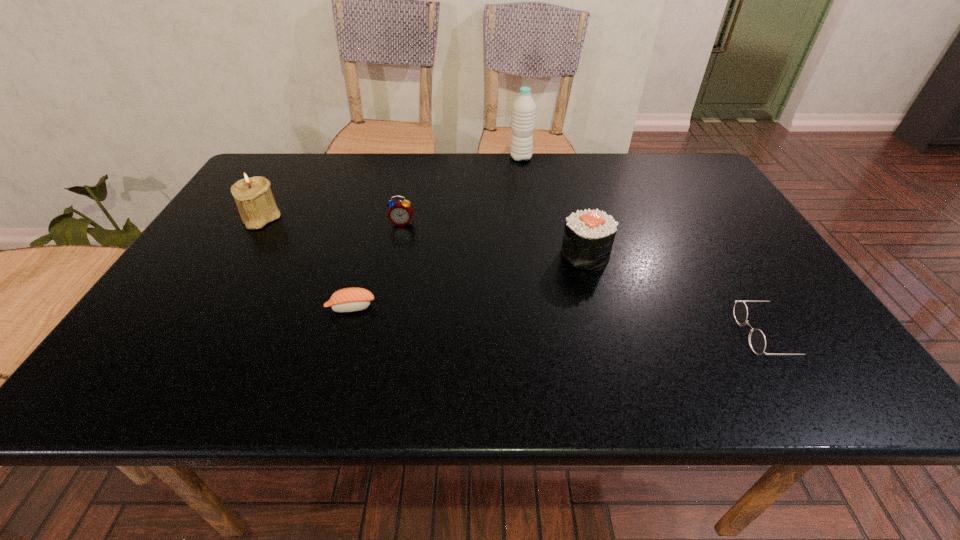
Where is `free region located 0.230m on the right of the tallest object`? This screenshot has height=540, width=960. free region located 0.230m on the right of the tallest object is located at coordinates (604, 158).

The image size is (960, 540). Identify the location of blank area located 0.290m on the front of the leftmost object. (201, 314).

The width and height of the screenshot is (960, 540). I want to click on vacant space located on the right of the farther sushi, so click(647, 255).

I want to click on vacant area located 0.260m on the front-facing side of the third shortest object, so click(386, 298).

Where is `vacant area situated on the front-facing side of the spectacles`? vacant area situated on the front-facing side of the spectacles is located at coordinates (652, 335).

Locate an element on the screen. Image resolution: width=960 pixels, height=540 pixels. vacant space situated on the front-facing side of the spectacles is located at coordinates (563, 335).

Image resolution: width=960 pixels, height=540 pixels. I want to click on vacant space situated 0.330m on the front-facing side of the spectacles, so click(x=577, y=335).

What are the coordinates of `free space located on the right of the shorter sushi` in the screenshot? It's located at point(549,308).

Where is `object located in the far edge section of the desktop`? This screenshot has height=540, width=960. object located in the far edge section of the desktop is located at coordinates (524, 108).

Find the location of a particular element. This screenshot has width=960, height=540. object positioned at the near edge is located at coordinates (757, 341).